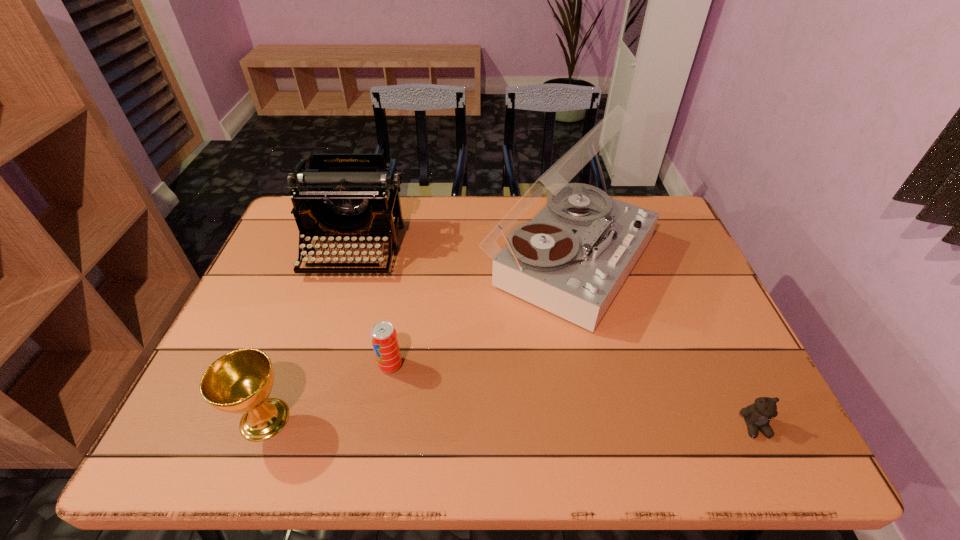
At what (x,y) coordinates should I click in order to perform the action: click on free location located on the right of the chalice. Please return your answer as a coordinate pair (x, y). Looking at the image, I should click on (384, 419).

Find the location of a particular element. vacant position located 0.100m on the back of the fourth tallest object is located at coordinates (397, 323).

The image size is (960, 540). I want to click on record player located at the far edge, so click(572, 258).

Where is `typewriter present at the far edge`? Image resolution: width=960 pixels, height=540 pixels. typewriter present at the far edge is located at coordinates (346, 197).

What are the coordinates of `chalice at the near edge` in the screenshot? It's located at (240, 381).

Where is `teddy bear that is positioned at the near edge`? This screenshot has width=960, height=540. teddy bear that is positioned at the near edge is located at coordinates (757, 416).

Locate an element on the screen. The width and height of the screenshot is (960, 540). typewriter at the left edge is located at coordinates (346, 197).

The height and width of the screenshot is (540, 960). Identify the location of chalice that is at the left edge. (240, 381).

This screenshot has width=960, height=540. In order to click on record player at the right edge in this screenshot , I will do `click(572, 258)`.

I want to click on teddy bear that is at the right edge, so click(757, 416).